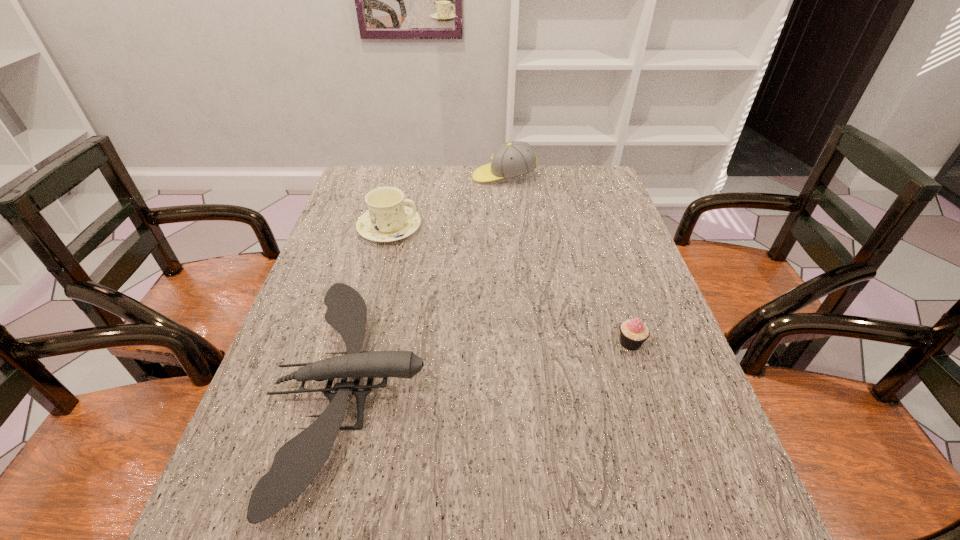
Find the location of a particular element. This screenshot has height=540, width=960. the farthest object is located at coordinates (515, 158).

Locate an element on the screen. This screenshot has width=960, height=540. baseball cap is located at coordinates (515, 158).

Identify the location of chinaware. (388, 219).

I want to click on drone, so click(x=295, y=465).

The image size is (960, 540). Identify the location of the rightmost object. (633, 332).

The image size is (960, 540). I want to click on cupcake, so click(x=633, y=332).

This screenshot has height=540, width=960. What are the coordinates of `vacant space located 0.240m on the front-facing side of the second object from right to left` in the screenshot? It's located at coord(405,177).

Identify the location of vacant area situated on the front-facing side of the second object from right to left. (442, 177).

Find the location of a particular element. free location located 0.390m on the front-facing side of the second object from right to left is located at coordinates (363, 177).

Identify the location of blank space located 0.120m on the handle side of the third nearest object. The height and width of the screenshot is (540, 960). (461, 227).